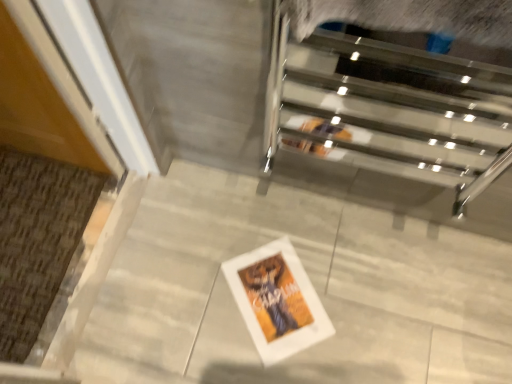
This screenshot has width=512, height=384. In order to click on white matte picture frame at center in this screenshot , I will do `click(277, 300)`.

What do you see at coordinates (277, 300) in the screenshot?
I see `white matte picture frame at center` at bounding box center [277, 300].

You are a GUI agent. You are given a task and a screenshot of the screen. Output one action in this format:
    pyautogui.click(x=<x>, y=<y>)
    Task: Click on the white matte picture frame at center
    This screenshot has height=384, width=512.
    Given the screenshot: What is the action you would take?
    pyautogui.click(x=277, y=300)